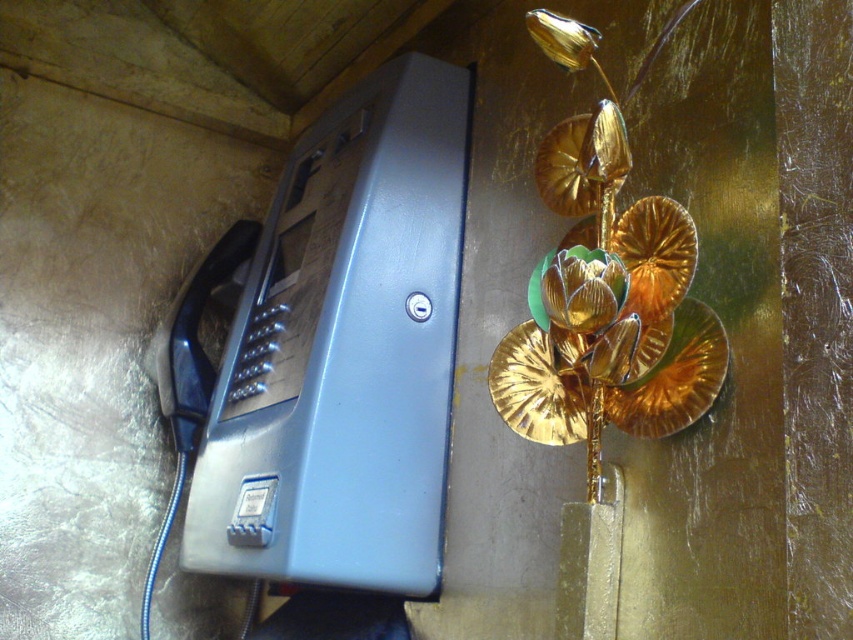
You are a delivery person trying to reach the apartment resident. You see the matte plastic phone box at left and the gold metallic flower at center. Which object should you interact with to call the resident?

You should interact with the matte plastic phone box at left to call the resident because it is the intercom unit, while the gold metallic flower at center is just a decorative item.

You are trying to hang a new picture frame that is 12 inches wide. You have two options on the wall where you can place it. The first option is to the right of the matte plastic phone box at left, and the second option is to the left of the gold metallic flower at center. Considering the sizes of the existing objects, which placement would allow the picture frame to fit without overlapping either object?

The matte plastic phone box at left is larger than the gold metallic flower at center. Therefore, placing the picture frame to the right of the matte plastic phone box at left would provide more space compared to placing it to the left of the gold metallic flower at center, allowing the 12 inch frame to fit without overlapping.

You are standing in front of a wall with two items. You need to hang a new picture frame between the matte plastic phone box at left and the gold metallic flower at center. Based on their positions, where should you place the frame so it is centered between them?

The matte plastic phone box at left is located below the gold metallic flower at center, so to center the picture frame between them, place it horizontally between the two objects but aligned with the lower position of the phone box.